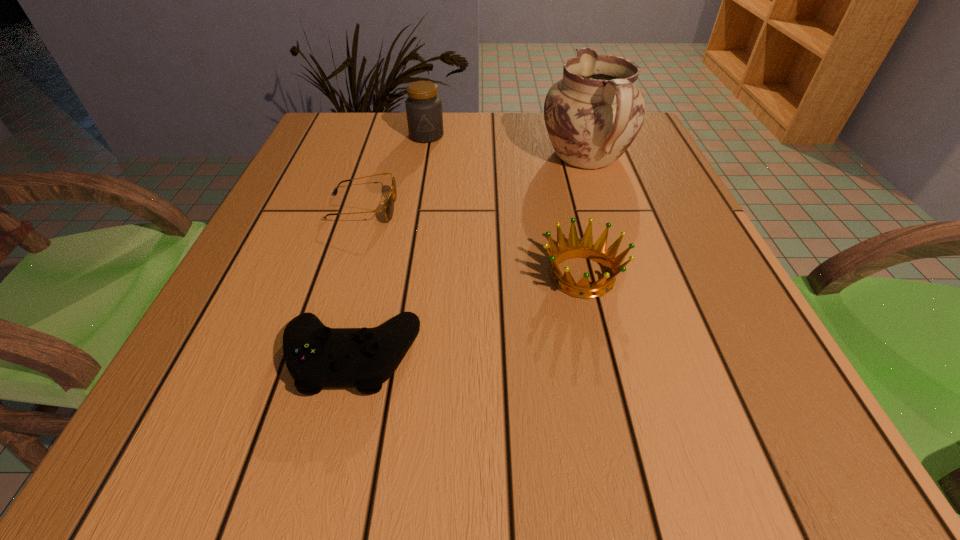
Locate an element on the screen. This screenshot has width=960, height=540. pitcher is located at coordinates (592, 115).

In order to click on jar in this screenshot , I will do [x=423, y=107].

The width and height of the screenshot is (960, 540). Find the location of `crown`. crown is located at coordinates (585, 249).

Where is `the third shortest object`? the third shortest object is located at coordinates (585, 249).

Locate an element on the screen. The width and height of the screenshot is (960, 540). the nearest object is located at coordinates (317, 357).

I want to click on control, so click(317, 357).

Where is `sunglasses`? The width and height of the screenshot is (960, 540). sunglasses is located at coordinates (389, 206).

The image size is (960, 540). What are the coordinates of `vacant space situated 0.050m on the spout of the tallest object` in the screenshot? It's located at (575, 122).

You are a GUI agent. You are given a task and a screenshot of the screen. Output one action in this format:
    pyautogui.click(x=<x>, y=<y>)
    Task: Click on the vacant space situated on the spout of the tallest object
    Image resolution: width=960 pixels, height=540 pixels.
    Given the screenshot: What is the action you would take?
    pyautogui.click(x=573, y=117)

At what (x,y) coordinates should I click in order to perform the action: click on blank space located on the surface of the fourth shortest object near the warning symbol. Please return your answer as a coordinate pair (x, y). This screenshot has width=960, height=540. Looking at the image, I should click on (417, 191).